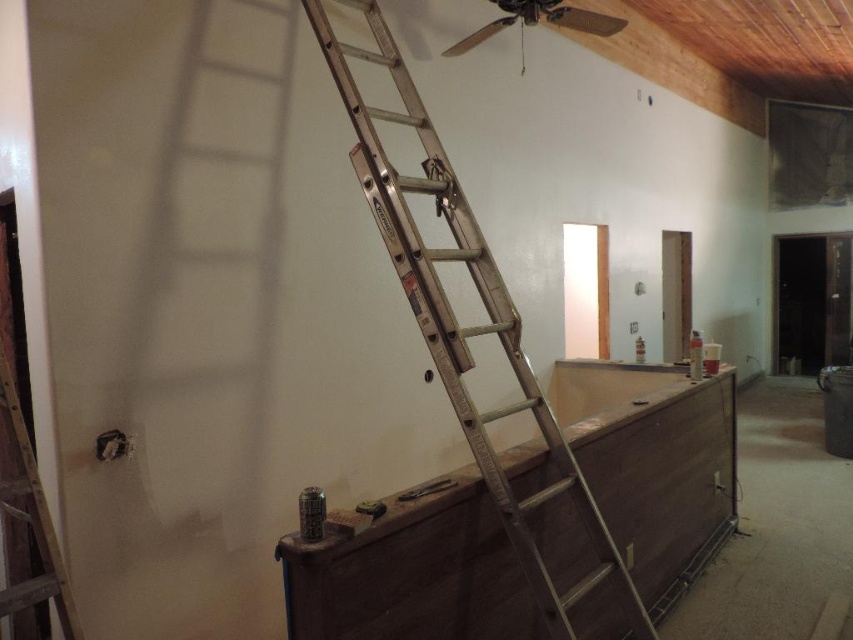
You are a contractor assessing the space. You need to determine if the silver metallic ladder at center can be stored underneath the metallic ceiling fan at upper center. Based on their sizes, is this feasible?

The silver metallic ladder at center is bigger than the metallic ceiling fan at upper center, so it may not fit underneath due to its larger size.

You are a contractor working in this space and need to reach the metallic ceiling fan at upper center to install it. Given that the silver metallic ladder at center is in your way, can you move the ladder to access the ceiling fan?

The silver metallic ladder at center is closer to the viewer than the metallic ceiling fan at upper center, so moving the ladder would allow you to access the ceiling fan.

You are standing in the construction area and need to reach the exposed wooden beams on the ceiling. Which ladder should you use, the silver metallic ladder at center or the metallic silver ladder at left?

The silver metallic ladder at center is above the metallic silver ladder at left, so you should use the silver metallic ladder at center to reach the exposed wooden beams on the ceiling.